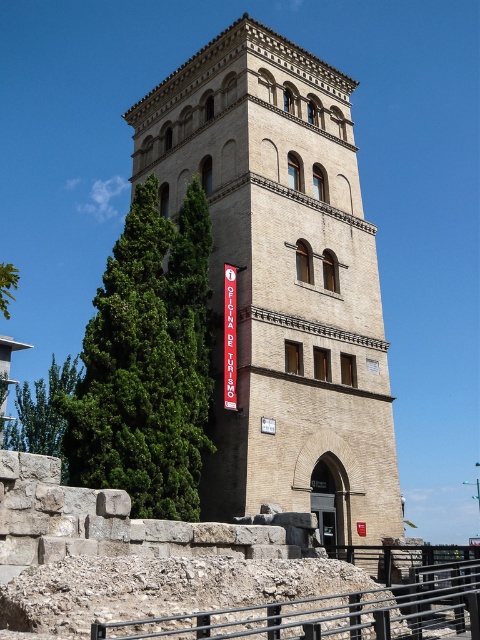
Looking at this image, does beige brick tower at center have a smaller size compared to black metal/rail at lower center?

No, beige brick tower at center is not smaller than black metal/rail at lower center.

Does point (250, 509) come behind point (465, 620)?

Yes, point (250, 509) is farther from viewer.

Locate an element on the screen. The width and height of the screenshot is (480, 640). beige brick tower at center is located at coordinates (283, 280).